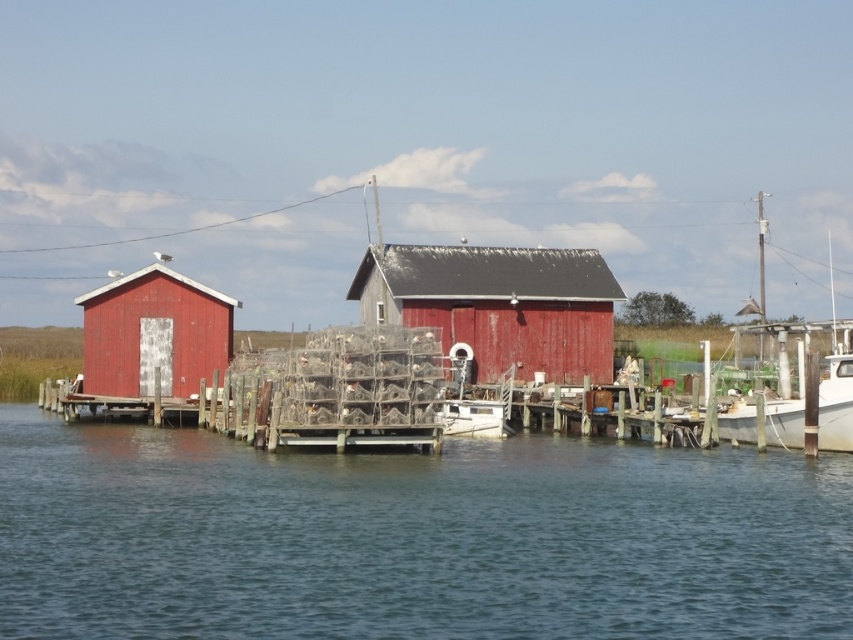
Question: Can you confirm if smooth red barn at center is wider than smooth wooden hut at left?

Choices:
 (A) no
 (B) yes

Answer: (B)

Question: Does transparent water at center come behind smooth red barn at center?

Choices:
 (A) yes
 (B) no

Answer: (B)

Question: Which object appears farthest from the camera in this image?

Choices:
 (A) white glossy boat at right
 (B) smooth red barn at center
 (C) smooth wooden hut at left

Answer: (B)

Question: Among these points, which one is nearest to the camera?

Choices:
 (A) (612, 280)
 (B) (140, 348)
 (C) (740, 396)

Answer: (C)

Question: Estimate the real-world distances between objects in this image. Which object is farther from the smooth red barn at center?

Choices:
 (A) transparent water at center
 (B) white glossy boat at right

Answer: (A)

Question: Considering the relative positions of smooth wooden hut at left and white glossy boat at right in the image provided, where is smooth wooden hut at left located with respect to white glossy boat at right?

Choices:
 (A) below
 (B) above

Answer: (A)